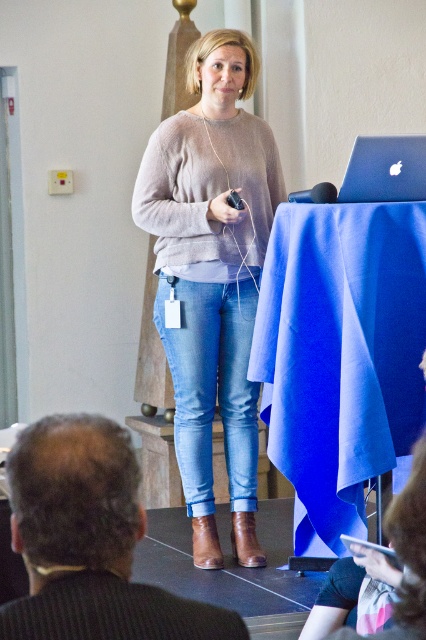
Question: Estimate the real-world distances between objects in this image. Which object is farther from the denim jeans at center?

Choices:
 (A) sleek silver laptop at upper right
 (B) blue fabric at center

Answer: (A)

Question: Is blue fabric at center below matte beige sweater at center?

Choices:
 (A) no
 (B) yes

Answer: (B)

Question: Is blue fabric at center in front of sleek silver laptop at upper right?

Choices:
 (A) no
 (B) yes

Answer: (B)

Question: Does matte beige sweater at center have a larger size compared to denim jeans at center?

Choices:
 (A) no
 (B) yes

Answer: (B)

Question: Based on their relative distances, which object is nearer to the blue fabric at center?

Choices:
 (A) matte beige sweater at center
 (B) denim jeans at center

Answer: (B)

Question: Which object is positioned farthest from the sleek silver laptop at upper right?

Choices:
 (A) denim jeans at center
 (B) blue fabric at center
 (C) matte beige sweater at center

Answer: (A)